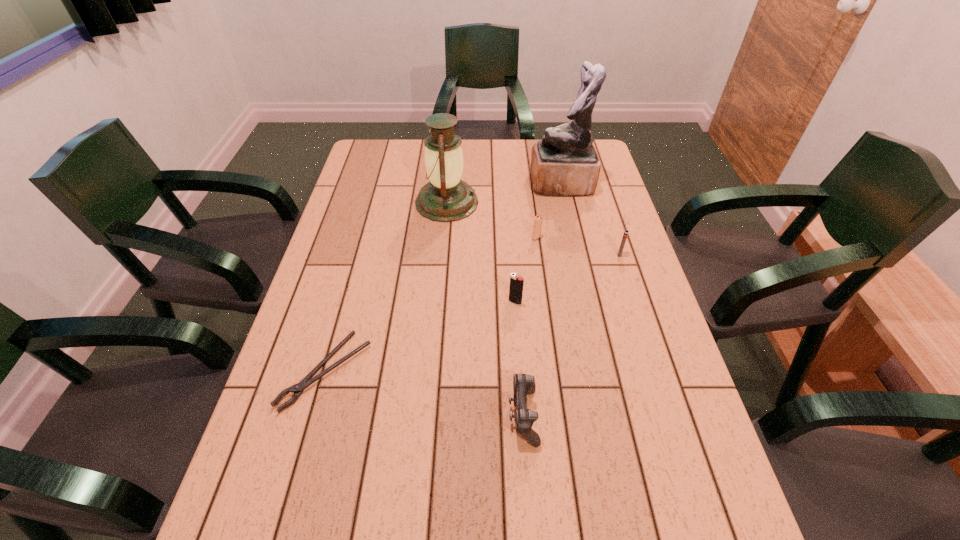
The width and height of the screenshot is (960, 540). I want to click on vacant region at the right edge of the desktop, so click(x=636, y=260).

You are a GUI agent. You are given a task and a screenshot of the screen. Output one action in this format:
    pyautogui.click(x=<x>, y=<y>)
    Task: Click on the vacant space at the far left corner
    
    Given the screenshot: What is the action you would take?
    pyautogui.click(x=388, y=146)

The width and height of the screenshot is (960, 540). What are the coordinates of `vacant area that lies between the tallest object and the rightmost igniter` in the screenshot? It's located at (590, 219).

Image resolution: width=960 pixels, height=540 pixels. Identify the location of empty space that is in between the tallest object and the control. (542, 300).

Where is `empty space between the tongs and the sixth shortest object`? The width and height of the screenshot is (960, 540). empty space between the tongs and the sixth shortest object is located at coordinates (387, 287).

The height and width of the screenshot is (540, 960). I want to click on vacant space that's between the shortest object and the nearest igniter, so click(x=420, y=336).

The width and height of the screenshot is (960, 540). I want to click on vacant point located between the control and the rightmost object, so click(571, 335).

Find the location of a particular element. The height and width of the screenshot is (540, 960). free space between the control and the rightmost igniter is located at coordinates (571, 335).

You are a GUI agent. You are given a task and a screenshot of the screen. Output one action in this format:
    pyautogui.click(x=<x>, y=<y>)
    Task: Click on the empty space that is in between the tallest object and the control
    The height and width of the screenshot is (540, 960).
    Given the screenshot: What is the action you would take?
    pyautogui.click(x=542, y=300)

I want to click on unoccupied area between the fourth farthest object and the tallest object, so click(x=590, y=219).